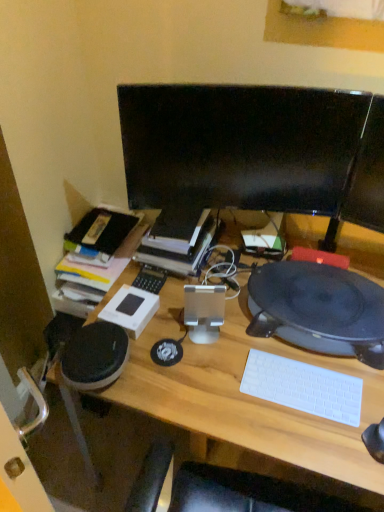
Locate an element on the screen. free spot above white plastic keyboard at lower right (from a real-world perspective) is located at coordinates (302, 384).